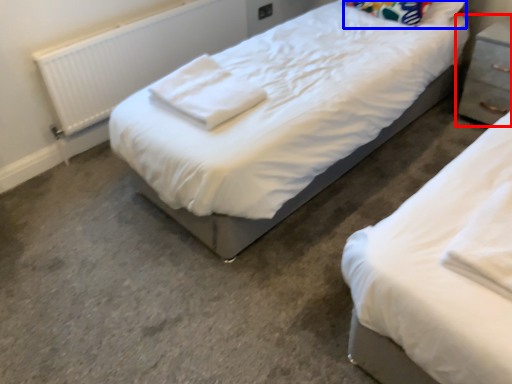
Question: Which object is further to the camera taking this photo, nightstand (highlighted by a red box) or pillow (highlighted by a blue box)?

Choices:
 (A) nightstand
 (B) pillow

Answer: (B)